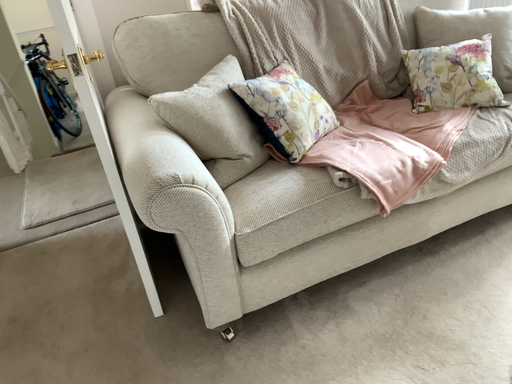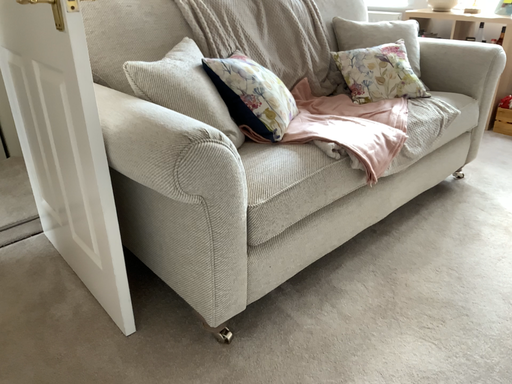
Question: How did the camera likely rotate when shooting the video?

Choices:
 (A) rotated left
 (B) rotated right

Answer: (B)